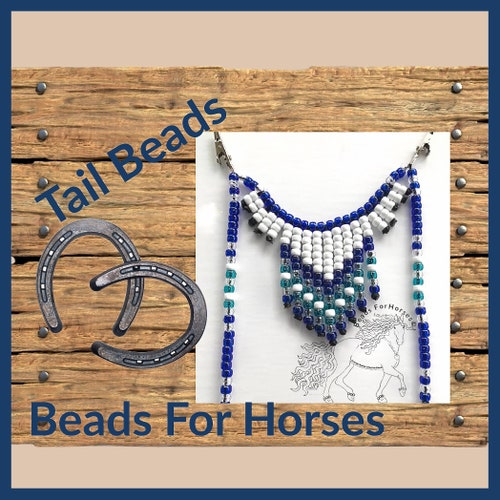
Identify the location of wooden boards. (96, 104), (149, 211), (84, 316), (92, 384).